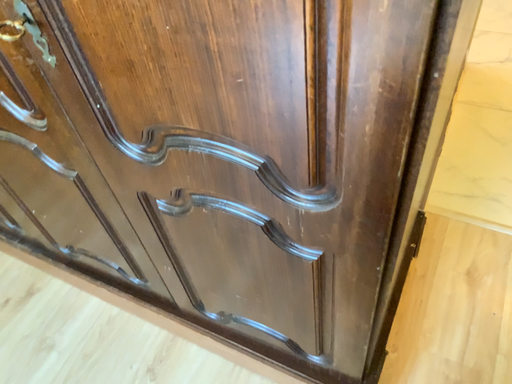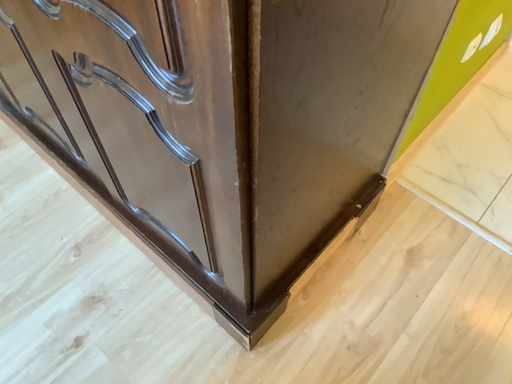
Question: Which way did the camera rotate in the video?

Choices:
 (A) rotated upward
 (B) rotated downward

Answer: (B)